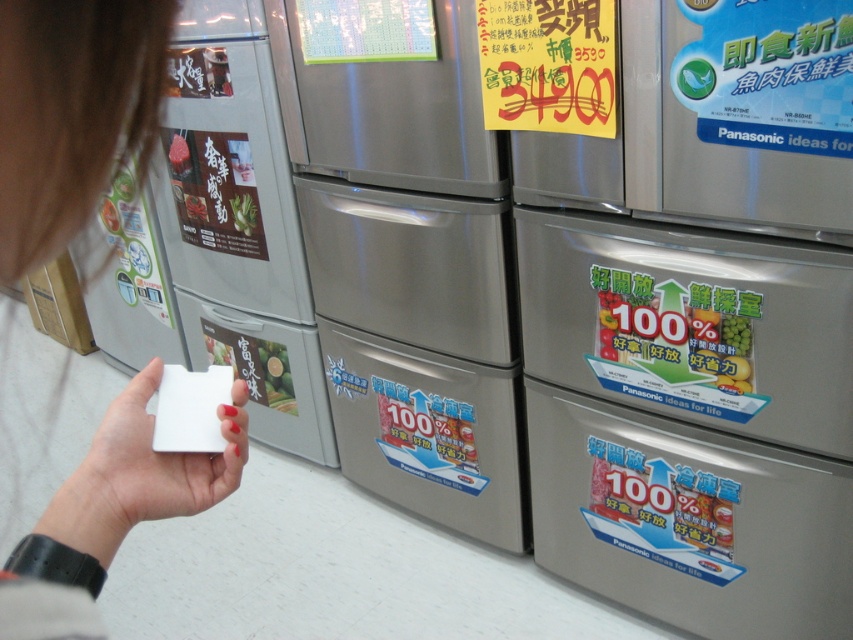
Which is more to the right, satin silver refrigerator at center or green matte refrigerator at center?

Positioned to the right is satin silver refrigerator at center.

Identify the location of satin silver refrigerator at center. This screenshot has width=853, height=640. (703, 330).

The height and width of the screenshot is (640, 853). Describe the element at coordinates (703, 330) in the screenshot. I see `satin silver refrigerator at center` at that location.

Is point (695, 474) more distant than point (340, 244)?

No, it is not.

Who is more distant from viewer, (804, 148) or (419, 225)?

Point (419, 225)

This screenshot has height=640, width=853. I want to click on satin silver refrigerator at center, so click(703, 330).

Can you confirm if satin silver refrigerator at center is bigger than white matte card at lower left?

Yes, satin silver refrigerator at center is bigger than white matte card at lower left.

Is satin silver refrigerator at center above white matte card at lower left?

Incorrect, satin silver refrigerator at center is not positioned above white matte card at lower left.

Identify the location of satin silver refrigerator at center. The height and width of the screenshot is (640, 853). (703, 330).